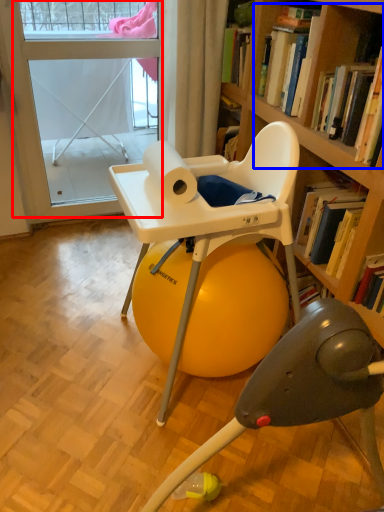
Question: Which object is further to the camera taking this photo, screen door (highlighted by a red box) or book (highlighted by a blue box)?

Choices:
 (A) screen door
 (B) book

Answer: (A)